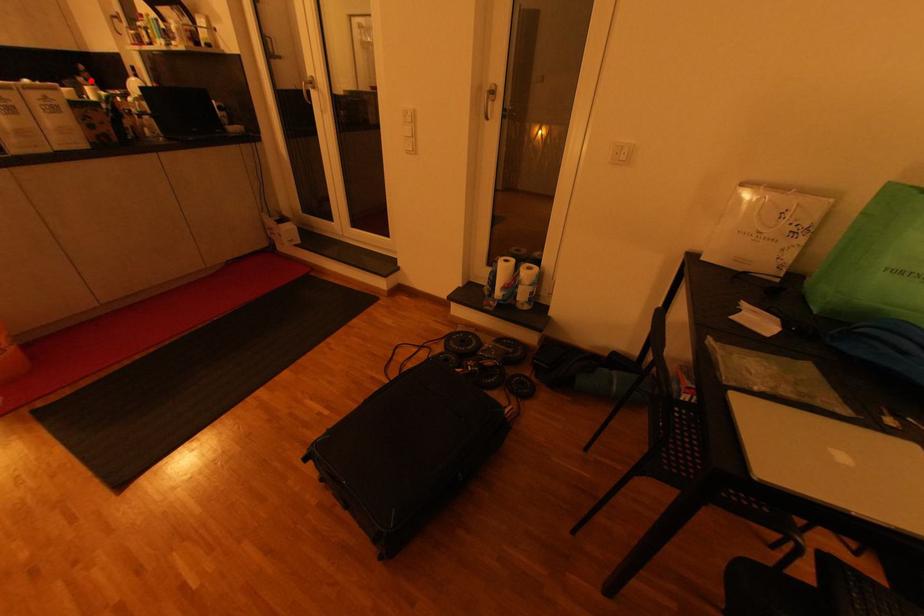
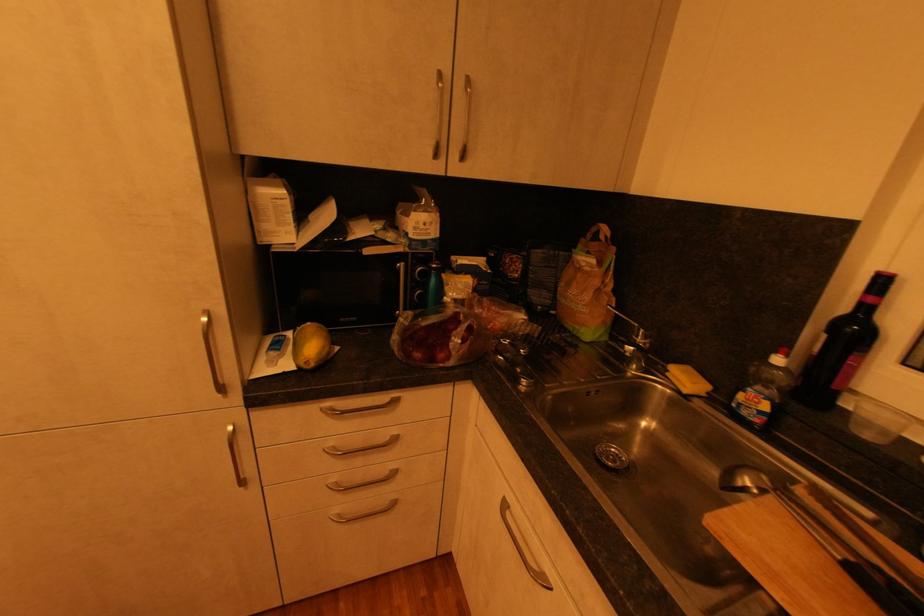
Locate, in the second image, the point that corresponds to the highlighted location in the first image.

(604, 264)